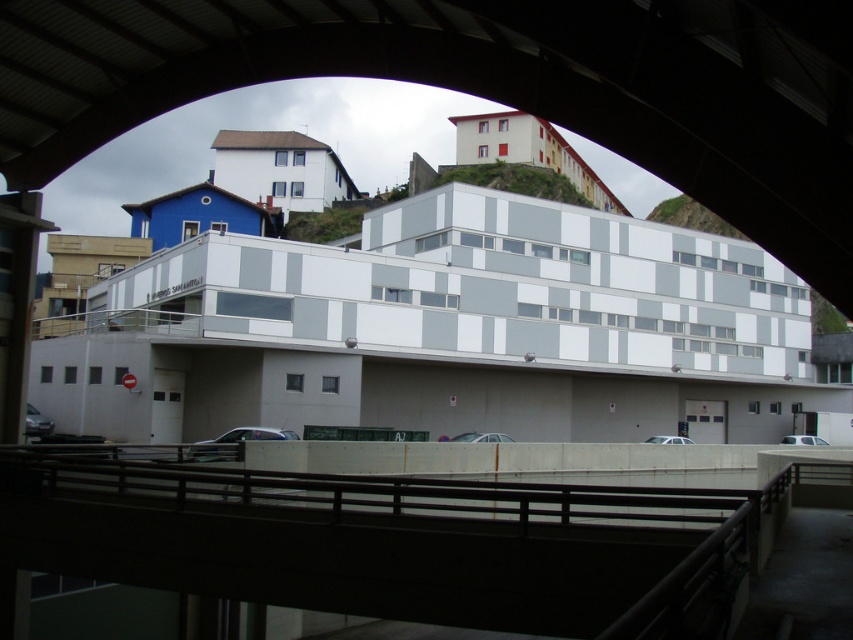
You are standing under the overpass and want to walk towards the black metal rail at center. Which direction should you move relative to the white matte building at center?

You should move to the right of the white matte building at center to reach the black metal rail at center, since the white matte building at center is located to the left of the black metal rail at center.

You are standing under the bridge and want to know how far the point marked at coordinates (561, 264) is from you. Can you determine the distance?

The point marked at coordinates (561, 264) is 51.96 meters away from the viewer.

Based on the photo, you are a delivery driver trying to navigate through the area under the bridge. You need to park your truck which is 10 meters long. The white concrete parking garage at center and the white matte building at center are both potential parking options. Based on their sizes, which one is more suitable for your truck?

The white concrete parking garage at center has a larger size compared to the white matte building at center, so it is more suitable for parking a truck that is 10 meters long.